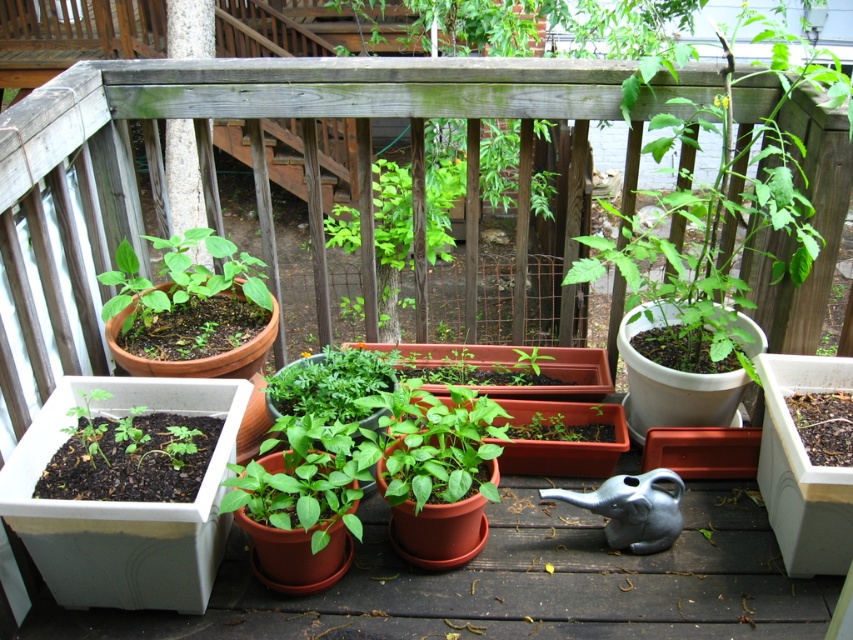
You are a gardener who wants to transplant a smaller green matte plant into a larger container. Looking at the green matte plant at center and the green matte plant at upper left, which one should you choose to transplant?

The green matte plant at upper left is smaller in size, so you should choose it to transplant into a larger container.

You are standing on the wooden deck and looking at the two points marked in the scene. Which point is closer to you, the point at coordinate (x=811, y=179) or the point at coordinate (x=122, y=340)?

Point (x=811, y=179) is in front of point (x=122, y=340), so it is closer to you.

You are standing on the wooden deck and want to water the plant at point (809, 220). Which plant should you water?

The green matte plant at center is located at point (809, 220), so you should water the green matte plant at center.